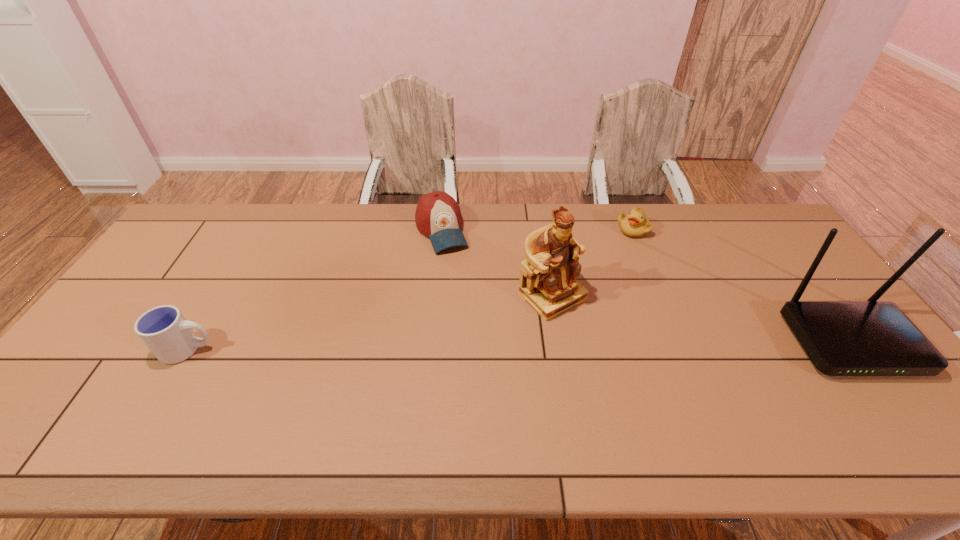
The width and height of the screenshot is (960, 540). I want to click on the leftmost object, so click(164, 330).

Identify the location of the rightmost object. (842, 338).

Identify the location of the fourth object from right to left. The image size is (960, 540). (438, 216).

The height and width of the screenshot is (540, 960). In order to click on figurine in this screenshot , I will do `click(548, 281)`.

I want to click on the shortest object, so click(x=636, y=224).

Locate an element on the screen. duckling is located at coordinates tap(636, 224).

The width and height of the screenshot is (960, 540). I want to click on vacant region located with the handle on the side of the cup, so click(367, 349).

This screenshot has width=960, height=540. Find the location of `vacant space located on the front-facing side of the router`. vacant space located on the front-facing side of the router is located at coordinates (898, 406).

You are a GUI agent. You are given a task and a screenshot of the screen. Output one action in this format:
    pyautogui.click(x=<x>, y=<y>)
    Task: Click on the free space located 0.060m on the front-facing side of the baseball cap
    Image resolution: width=960 pixels, height=540 pixels.
    Given the screenshot: What is the action you would take?
    pyautogui.click(x=454, y=266)

At what (x,y) coordinates should I click in order to perform the action: click on vacant space situated on the front-facing side of the baseball cap. Please return your answer as a coordinate pair (x, y). The width and height of the screenshot is (960, 540). Looking at the image, I should click on (487, 337).